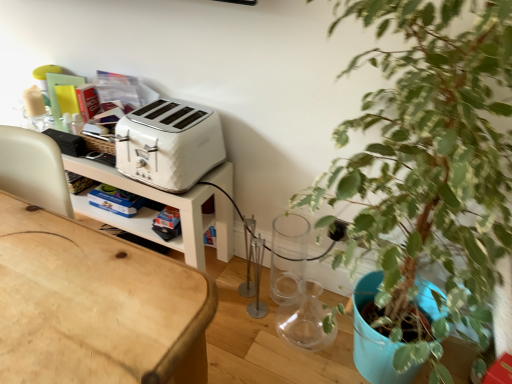
Question: Is there a large distance between white plastic toaster at upper center and green leafy plant at right?

Choices:
 (A) yes
 (B) no

Answer: (B)

Question: Is white plastic toaster at upper center to the left of green leafy plant at right from the viewer's perspective?

Choices:
 (A) yes
 (B) no

Answer: (A)

Question: Does white plastic toaster at upper center have a larger size compared to green leafy plant at right?

Choices:
 (A) yes
 (B) no

Answer: (B)

Question: Considering the relative sizes of white plastic toaster at upper center and green leafy plant at right in the image provided, is white plastic toaster at upper center thinner than green leafy plant at right?

Choices:
 (A) yes
 (B) no

Answer: (A)

Question: Does white plastic toaster at upper center appear on the right side of green leafy plant at right?

Choices:
 (A) no
 (B) yes

Answer: (A)

Question: Is white plastic toaster at upper center positioned behind green leafy plant at right?

Choices:
 (A) no
 (B) yes

Answer: (B)

Question: Is the position of green leafy plant at right more distant than that of white plastic toaster at upper center?

Choices:
 (A) no
 (B) yes

Answer: (A)

Question: Can you confirm if green leafy plant at right is taller than white plastic toaster at upper center?

Choices:
 (A) yes
 (B) no

Answer: (A)

Question: Would you say white plastic toaster at upper center is part of green leafy plant at right's contents?

Choices:
 (A) no
 (B) yes

Answer: (A)

Question: Does green leafy plant at right lie in front of white plastic toaster at upper center?

Choices:
 (A) no
 (B) yes

Answer: (B)

Question: Considering the relative sizes of green leafy plant at right and white plastic toaster at upper center in the image provided, is green leafy plant at right shorter than white plastic toaster at upper center?

Choices:
 (A) no
 (B) yes

Answer: (A)

Question: Is green leafy plant at right facing towards white plastic toaster at upper center?

Choices:
 (A) yes
 (B) no

Answer: (B)

Question: Is green leafy plant at right bigger or smaller than white plastic toaster at upper center?

Choices:
 (A) small
 (B) big

Answer: (B)